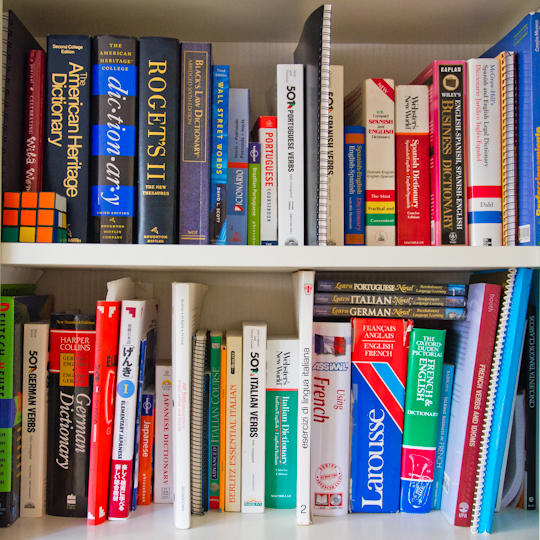
Find the location of `blue books`. blue books is located at coordinates (516, 345), (442, 422), (529, 210), (218, 170), (118, 162), (355, 148), (140, 388), (369, 454).